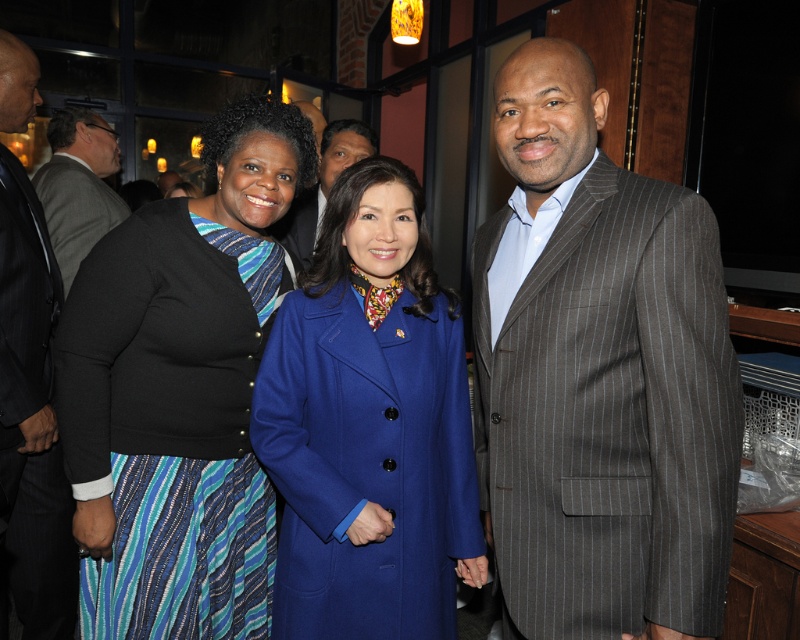
Does gray pinstripe suit at left appear on the right side of gray pinstripe suit at center?

Incorrect, gray pinstripe suit at left is not on the right side of gray pinstripe suit at center.

Image resolution: width=800 pixels, height=640 pixels. What do you see at coordinates (78, 186) in the screenshot?
I see `gray pinstripe suit at left` at bounding box center [78, 186].

Which is behind, point (102, 232) or point (328, 166)?

Point (102, 232)

Where is `gray pinstripe suit at left`? gray pinstripe suit at left is located at coordinates (78, 186).

Is blue wool coat at center closer to the viewer compared to gray pinstripe suit at center?

Yes.

Does blue wool coat at center have a greater height compared to gray pinstripe suit at center?

Yes.

This screenshot has width=800, height=640. What do you see at coordinates (368, 428) in the screenshot?
I see `blue wool coat at center` at bounding box center [368, 428].

I want to click on blue wool coat at center, so click(x=368, y=428).

Is gray pinstripe suit at right taller than gray pinstripe suit at left?

Correct, gray pinstripe suit at right is much taller as gray pinstripe suit at left.

Is gray pinstripe suit at right further to camera compared to gray pinstripe suit at left?

No, gray pinstripe suit at right is closer to the viewer.

In order to click on gray pinstripe suit at right in this screenshot , I will do `click(610, 417)`.

I want to click on gray pinstripe suit at right, so click(x=610, y=417).